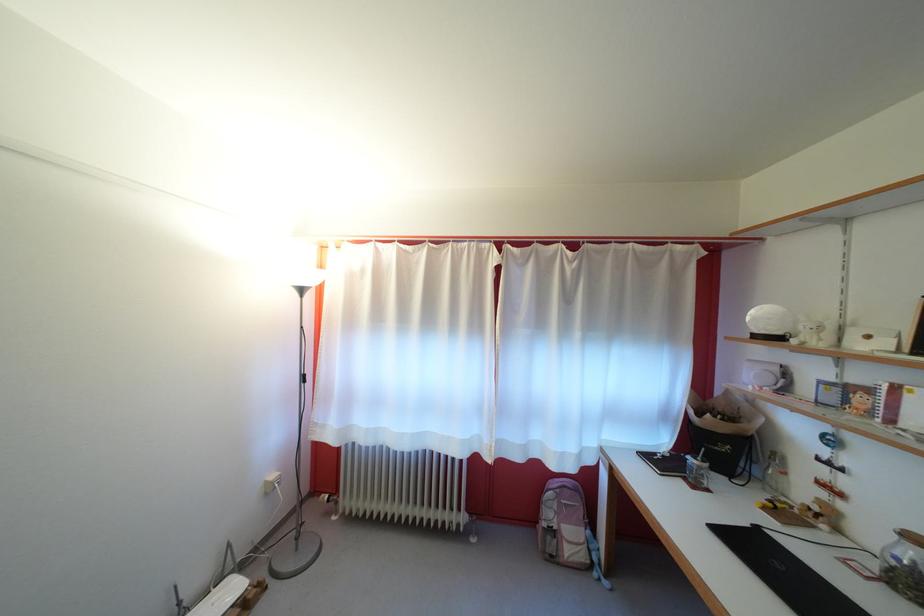
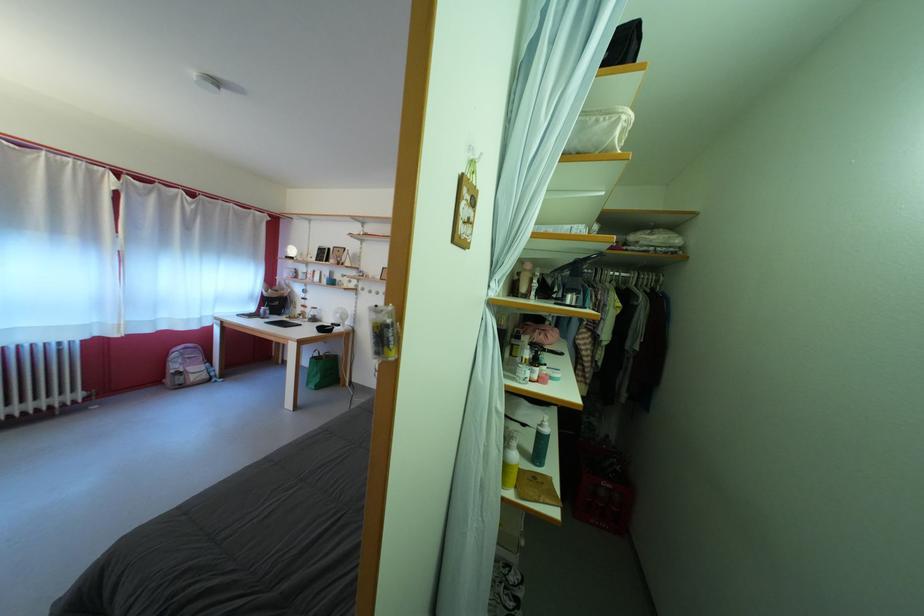
Where in the second image is the point corresponding to the point at 556,521 from the first image?

(184, 373)